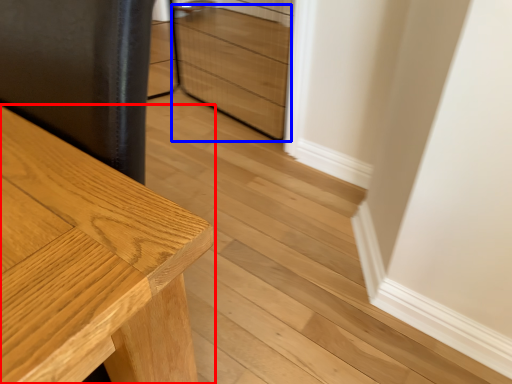
Question: Which object is closer to the camera taking this photo, table (highlighted by a red box) or drawer (highlighted by a blue box)?

Choices:
 (A) table
 (B) drawer

Answer: (A)